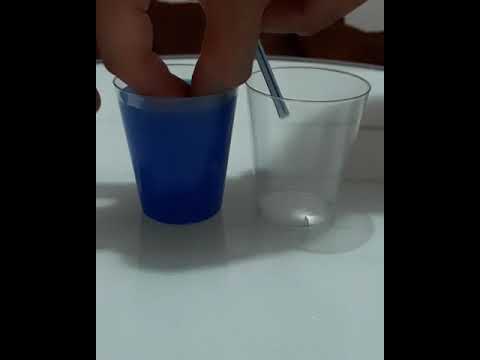
You are a GUI agent. You are given a task and a screenshot of the screen. Output one action in this format:
    pyautogui.click(x=<x>, y=<y>)
    Task: Click on the table top
    This screenshot has width=480, height=360.
    Given the screenshot: What is the action you would take?
    pyautogui.click(x=256, y=296)